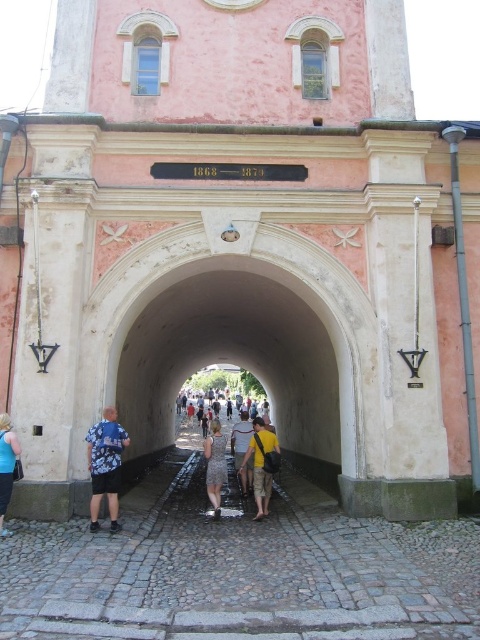
Question: Is floral shirt at center bigger than yellow fabric shirt at center?

Choices:
 (A) no
 (B) yes

Answer: (A)

Question: Which is nearer to the dark gray cotton shirt at center?

Choices:
 (A) blue denim shorts at lower left
 (B) patterned dress at center
 (C) floral shirt at center
 (D) white stone tunnel at center

Answer: (B)

Question: Which object is closer to the camera taking this photo?

Choices:
 (A) dark gray cotton shirt at center
 (B) floral shirt at center

Answer: (B)

Question: Which of the following is the farthest from the observer?

Choices:
 (A) (211, 403)
 (B) (265, 483)
 (C) (286, 403)
 (D) (248, 426)

Answer: (A)

Question: Is yellow fabric shirt at center bigger than patterned dress at center?

Choices:
 (A) no
 (B) yes

Answer: (A)

Question: Can you confirm if yellow fabric shirt at center is positioned above dark gray cotton shirt at center?

Choices:
 (A) yes
 (B) no

Answer: (A)